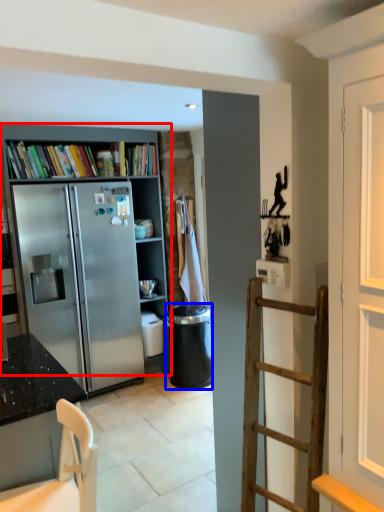
Question: Which object appears farthest to the camera in this image, bookcase (highlighted by a red box) or trash bin/can (highlighted by a blue box)?

Choices:
 (A) bookcase
 (B) trash bin/can

Answer: (B)